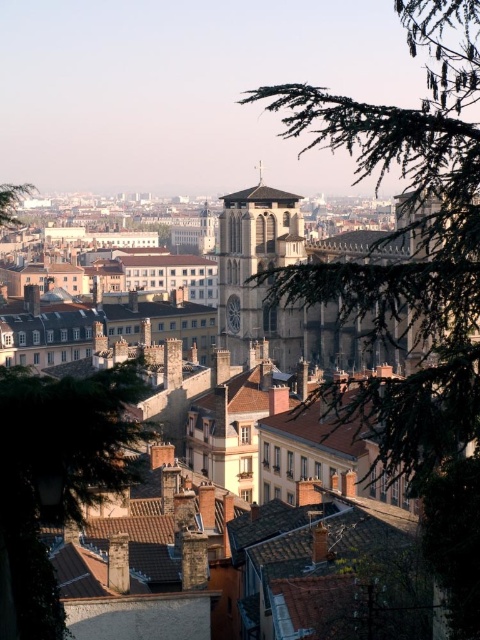
Question: Is green leafy tree at lower left in front of green leafy tree at upper left?

Choices:
 (A) no
 (B) yes

Answer: (B)

Question: Does green leafy tree at lower left lie behind green leafy tree at upper left?

Choices:
 (A) no
 (B) yes

Answer: (A)

Question: Is green textured tree at upper right further to camera compared to green leafy tree at lower left?

Choices:
 (A) yes
 (B) no

Answer: (B)

Question: Which of the following is the closest to the observer?

Choices:
 (A) green leafy tree at upper left
 (B) stone gothic cathedral at center
 (C) green leafy tree at lower left
 (D) stone church at center

Answer: (D)

Question: Among these objects, which one is farthest from the camera?

Choices:
 (A) green leafy tree at lower left
 (B) stone gothic cathedral at center
 (C) green leafy tree at upper left

Answer: (B)

Question: Which point is closer to the camera?

Choices:
 (A) (243, 272)
 (B) (67, 396)

Answer: (B)